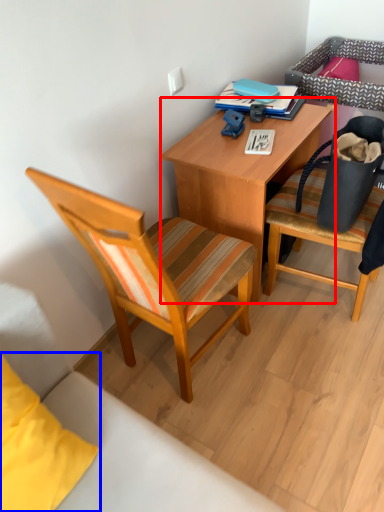
Question: Which object is closer to the camera taking this photo, desk (highlighted by a red box) or pillow (highlighted by a blue box)?

Choices:
 (A) desk
 (B) pillow

Answer: (B)